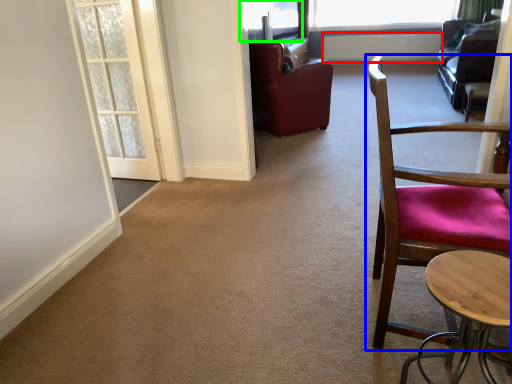
Question: Based on their relative distances, which object is farther from radiator (highlighted by a red box)? Choose from chair (highlighted by a blue box) and window screen (highlighted by a green box).

Choices:
 (A) chair
 (B) window screen

Answer: (A)